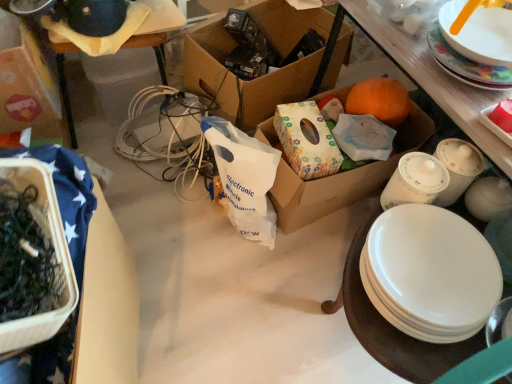
At what (x,y) coordinates should I click in order to perform the action: click on white glossy plate at lower right, the 2th plate positioned from the top. Please return your answer as a coordinate pair (x, y). This screenshot has height=384, width=512. Looking at the image, I should click on (430, 273).

In order to face brown cardboard box at center, the 3th box from the left, should I rotate leftwards or rightwards?

To face it directly, rotate right by 0.172 degrees.

Consider the image. In order to face white glossy plate at upper right, acting as the second plate starting from the bottom, should I rotate leftwards or rightwards?

To align with it, rotate right about 28.885°.

I want to click on cardboard box at center, which is counted as the 4th box, starting from the left, so click(x=342, y=179).

Considering the sizes of white plastic table at lower left and white glossy plate at upper right, acting as the second plate starting from the bottom, in the image, is white plastic table at lower left bigger or smaller than white glossy plate at upper right, acting as the second plate starting from the bottom,?

Considering their sizes, white plastic table at lower left takes up more space than white glossy plate at upper right, acting as the second plate starting from the bottom.

Can you confirm if white plastic table at lower left is taller than white glossy plate at upper right, acting as the second plate starting from the bottom?

Correct, white plastic table at lower left is much taller as white glossy plate at upper right, acting as the second plate starting from the bottom.

From the image's perspective, is white plastic table at lower left located above white glossy plate at upper right, acting as the second plate starting from the bottom?

Yes.

How many degrees apart are the facing directions of white plastic table at lower left and white glossy plate at upper right, the first plate when ordered from top to bottom?

They differ by 96.9 degrees in their facing directions.

Which is behind, white glossy plate at upper right, the first plate when ordered from top to bottom, or white plastic bag at center?

Positioned behind is white plastic bag at center.

Would you say white plastic bag at center is part of white glossy plate at upper right, acting as the second plate starting from the bottom,'s contents?

That's incorrect, white plastic bag at center is not inside white glossy plate at upper right, acting as the second plate starting from the bottom.

Which is farther, (482, 55) or (251, 211)?

The point (251, 211) is behind.

This screenshot has width=512, height=384. Find the location of `shopping bag behind the white glossy plate at upper right, acting as the second plate starting from the bottom`. shopping bag behind the white glossy plate at upper right, acting as the second plate starting from the bottom is located at coordinates (244, 178).

From the picture: Would you say white glossy plate at lower right, placed as the 1th plate when sorted from bottom to top, is part of brown cardboard box at center, the 3th box from the left,'s contents?

No, white glossy plate at lower right, placed as the 1th plate when sorted from bottom to top, is not surrounded by brown cardboard box at center, the 3th box from the left.

There is a brown cardboard box at center, the 3th box from the left. In order to click on the 1st plate above it (from a real-world perspective) in this screenshot , I will do coord(430,273).

Is brown cardboard box at center, the 3th box from the left, turned away from white glossy plate at lower right, the 2th plate positioned from the top?

brown cardboard box at center, the 3th box from the left, is not turned away from white glossy plate at lower right, the 2th plate positioned from the top.

Considering the positions of objects brown cardboard box at center, the 3th box from the left, and white glossy plate at lower right, the 2th plate positioned from the top, in the image provided, who is more to the left, brown cardboard box at center, the 3th box from the left, or white glossy plate at lower right, the 2th plate positioned from the top,?

Positioned to the left is brown cardboard box at center, the 3th box from the left.

Would you say white plastic bag at center contains cardboard box at upper left, positioned as the 1th box in left-to-right order?

No, cardboard box at upper left, positioned as the 1th box in left-to-right order, is located outside of white plastic bag at center.

You are a GUI agent. You are given a task and a screenshot of the screen. Output one action in this format:
    pyautogui.click(x=<x>, y=<y>)
    Task: Click on the shopping bag below the cardboard box at upper left, positioned as the 1th box in left-to-right order (from a real-world perspective)
    
    Given the screenshot: What is the action you would take?
    pyautogui.click(x=244, y=178)

Considering the sizes of objects white plastic bag at center and cardboard box at upper left, positioned as the 1th box in left-to-right order, in the image provided, who is bigger, white plastic bag at center or cardboard box at upper left, positioned as the 1th box in left-to-right order,?

cardboard box at upper left, positioned as the 1th box in left-to-right order.

Is white plastic bag at center facing away from cardboard box at upper left, positioned as the 1th box in left-to-right order?

white plastic bag at center does not have its back to cardboard box at upper left, positioned as the 1th box in left-to-right order.

Is white glossy plate at lower right, the 2th plate positioned from the top, at the back of matte white platter at upper right?

No, white glossy plate at lower right, the 2th plate positioned from the top, is not at the back of matte white platter at upper right.

Looking at their sizes, would you say matte white platter at upper right is wider or thinner than white glossy plate at lower right, placed as the 1th plate when sorted from bottom to top?

In the image, matte white platter at upper right appears to be more narrow than white glossy plate at lower right, placed as the 1th plate when sorted from bottom to top.

The height and width of the screenshot is (384, 512). Identify the location of plate lying below the matte white platter at upper right (from the image's perspective). (430, 273).

Looking at this image, relative to white glossy plate at lower right, placed as the 1th plate when sorted from bottom to top, is matte white platter at upper right in front or behind?

Visually, matte white platter at upper right is located behind white glossy plate at lower right, placed as the 1th plate when sorted from bottom to top.

From a real-world perspective, is cardboard box at upper left, placed as the fourth box when sorted from right to left, above or below translucent plastic container at left, which is the 3th box from right to left?

In terms of real-world spatial position, cardboard box at upper left, placed as the fourth box when sorted from right to left, is below translucent plastic container at left, which is the 3th box from right to left.

Who is smaller, cardboard box at upper left, positioned as the 1th box in left-to-right order, or translucent plastic container at left, which is the 3th box from right to left?

Smaller between the two is translucent plastic container at left, which is the 3th box from right to left.

Does point (20, 122) come closer to viewer compared to point (55, 312)?

No, (20, 122) is behind (55, 312).

Is cardboard box at upper left, positioned as the 1th box in left-to-right order, taller or shorter than translucent plastic container at left, arranged as the 2th box when viewed from the left?

cardboard box at upper left, positioned as the 1th box in left-to-right order, is taller than translucent plastic container at left, arranged as the 2th box when viewed from the left.

Is brown cardboard box at center, the 2th box when ordered from right to left, shorter than white glossy plate at upper right, acting as the second plate starting from the bottom?

Incorrect, the height of brown cardboard box at center, the 2th box when ordered from right to left, does not fall short of that of white glossy plate at upper right, acting as the second plate starting from the bottom.

At what (x,y) coordinates should I click in order to perform the action: click on box that is the 3rd object located behind the white glossy plate at upper right, acting as the second plate starting from the bottom. Please return your answer as a coordinate pair (x, y). Looking at the image, I should click on (239, 78).

From the image's perspective, which one is positioned lower, brown cardboard box at center, the 3th box from the left, or white glossy plate at upper right, the first plate when ordered from top to bottom?

white glossy plate at upper right, the first plate when ordered from top to bottom, appears lower in the image.

Is brown cardboard box at center, the 2th box when ordered from right to left, aimed at white glossy plate at upper right, the first plate when ordered from top to bottom?

No, brown cardboard box at center, the 2th box when ordered from right to left, does not turn towards white glossy plate at upper right, the first plate when ordered from top to bottom.

Where is `the 2nd plate positioned above the white plastic table at lower left (from a real-world perspective)`? The width and height of the screenshot is (512, 384). the 2nd plate positioned above the white plastic table at lower left (from a real-world perspective) is located at coordinates (479, 33).

Where is `plate above the white plastic bag at center (from the image's perspective)`? The width and height of the screenshot is (512, 384). plate above the white plastic bag at center (from the image's perspective) is located at coordinates (479, 33).

Based on their spatial positions, is brown cardboard box at center, the 3th box from the left, or cardboard box at upper left, placed as the fourth box when sorted from right to left, further from matte white platter at upper right?

cardboard box at upper left, placed as the fourth box when sorted from right to left, is positioned further to the anchor matte white platter at upper right.

From the picture: From the image, which object appears to be nearer to translucent plastic container at left, which is the 3th box from right to left, white plastic bag at center or white plastic table at lower left?

Based on the image, white plastic bag at center appears to be nearer to translucent plastic container at left, which is the 3th box from right to left.

Estimate the real-world distances between objects in this image. Which object is closer to translucent plastic container at left, which is the 3th box from right to left, white glossy plate at lower right, the 2th plate positioned from the top, or white glossy plate at upper right, the first plate when ordered from top to bottom?

white glossy plate at lower right, the 2th plate positioned from the top.

Which object lies further to the anchor point white glossy plate at lower right, placed as the 1th plate when sorted from bottom to top, brown cardboard box at center, the 3th box from the left, or translucent plastic container at left, which is the 3th box from right to left?

Among the two, brown cardboard box at center, the 3th box from the left, is located further to white glossy plate at lower right, placed as the 1th plate when sorted from bottom to top.

From the image, which object appears to be farther from matte white platter at upper right, white glossy plate at upper right, the first plate when ordered from top to bottom, or cardboard box at center, which is counted as the 4th box, starting from the left?

cardboard box at center, which is counted as the 4th box, starting from the left.

Based on their spatial positions, is brown cardboard box at center, the 3th box from the left, or white plastic table at lower left closer to matte white platter at upper right?

The object closer to matte white platter at upper right is brown cardboard box at center, the 3th box from the left.

Estimate the real-world distances between objects in this image. Which object is closer to white glossy plate at upper right, the first plate when ordered from top to bottom, white plastic table at lower left or brown cardboard box at center, the 3th box from the left?

brown cardboard box at center, the 3th box from the left, is closer to white glossy plate at upper right, the first plate when ordered from top to bottom.

Based on their spatial positions, is white plastic table at lower left or white glossy plate at lower right, placed as the 1th plate when sorted from bottom to top, further from translucent plastic container at left, which is the 3th box from right to left?

white plastic table at lower left is positioned further to the anchor translucent plastic container at left, which is the 3th box from right to left.

Find the location of a particular element. Image resolution: width=512 pixels, height=384 pixels. platter between white glossy plate at upper right, acting as the second plate starting from the bottom, and cardboard box at center, which is counted as the 4th box, starting from the left, from front to back is located at coordinates (494, 126).

Identify the location of table situated between cardboard box at upper left, positioned as the 1th box in left-to-right order, and brown cardboard box at center, the 3th box from the left, from left to right. The height and width of the screenshot is (384, 512). (152, 47).

Where is `shopping bag between white plastic table at lower left and cardboard box at center, which is counted as the 4th box, starting from the left`? The image size is (512, 384). shopping bag between white plastic table at lower left and cardboard box at center, which is counted as the 4th box, starting from the left is located at coordinates (244, 178).

At what (x,y) coordinates should I click in order to perform the action: click on platter located between white glossy plate at upper right, acting as the second plate starting from the bottom, and brown cardboard box at center, the 3th box from the left, in the depth direction. Please return your answer as a coordinate pair (x, y). Looking at the image, I should click on (494, 126).